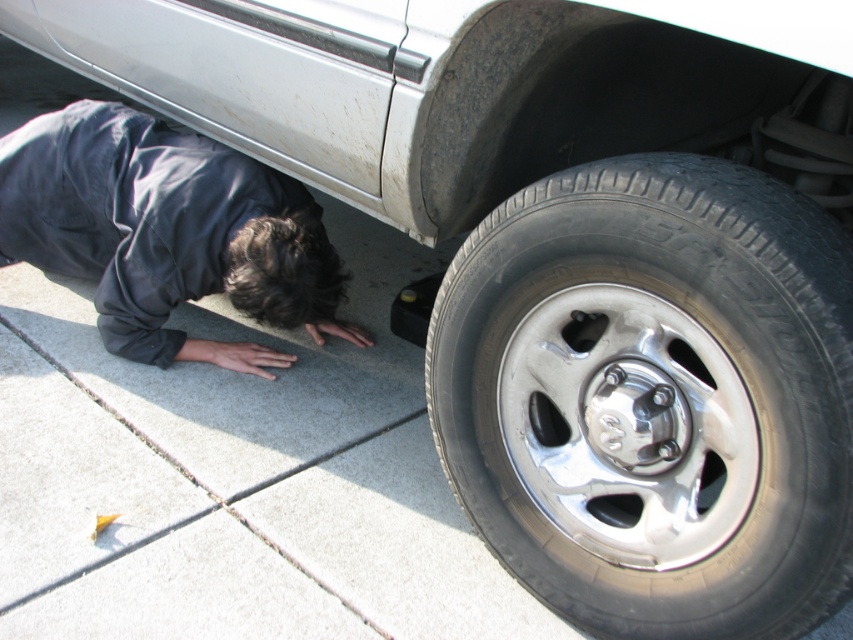
Question: Among these points, which one is farthest from the camera?

Choices:
 (A) (268, 186)
 (B) (483, 404)
 (C) (640, 536)

Answer: (A)

Question: From the image, what is the correct spatial relationship of polished silver wheel at lower right in relation to dark gray fabric at lower left?

Choices:
 (A) left
 (B) right

Answer: (B)

Question: Which object is closer to the camera taking this photo?

Choices:
 (A) silver metallic rim at lower right
 (B) dark gray fabric at lower left
 (C) polished silver wheel at lower right

Answer: (C)

Question: Can you confirm if dark gray fabric at lower left is positioned below silver metallic rim at lower right?

Choices:
 (A) no
 (B) yes

Answer: (A)

Question: Is dark gray fabric at lower left positioned before silver metallic rim at lower right?

Choices:
 (A) no
 (B) yes

Answer: (A)

Question: Which point is closer to the camera?

Choices:
 (A) polished silver wheel at lower right
 (B) dark gray fabric at lower left
 (C) silver metallic rim at lower right

Answer: (A)